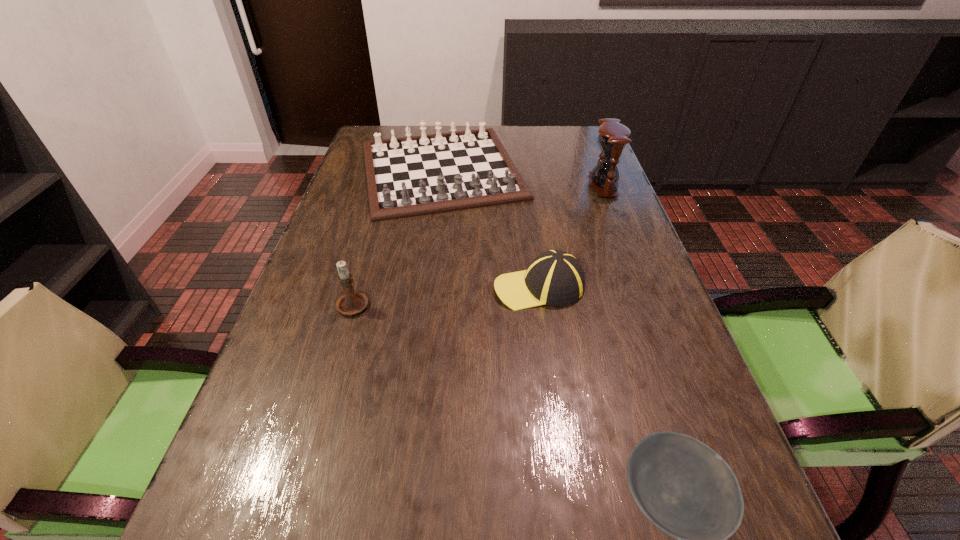
Where is `vacant area located with the brim of the baseball cap facing forward`? This screenshot has width=960, height=540. vacant area located with the brim of the baseball cap facing forward is located at coordinates (463, 287).

Find the location of `vacant space located with the brim of the baseball cap facing forward`. vacant space located with the brim of the baseball cap facing forward is located at coordinates (445, 287).

Identify the location of object located in the far edge section of the desktop. The height and width of the screenshot is (540, 960). (410, 176).

Locate an element on the screen. candle holder present at the left edge is located at coordinates (351, 303).

Where is `chessboard that is at the left edge`? The height and width of the screenshot is (540, 960). chessboard that is at the left edge is located at coordinates (410, 176).

Where is `object positioned at the right edge`? object positioned at the right edge is located at coordinates (613, 136).

Where is `object positioned at the far left corner`? This screenshot has width=960, height=540. object positioned at the far left corner is located at coordinates (410, 176).

Where is `vacant space at the far edge of the desktop`? The image size is (960, 540). vacant space at the far edge of the desktop is located at coordinates (491, 127).

Where is `vacant point at the left edge`? vacant point at the left edge is located at coordinates (315, 356).

The image size is (960, 540). I want to click on free space at the right edge of the desktop, so click(x=619, y=310).